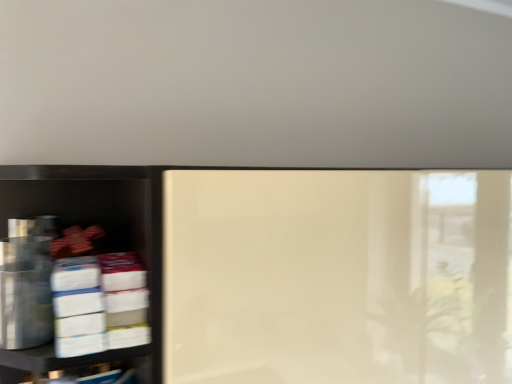
Question: From a real-world perspective, relative to metallic silver canisters at left, marked as the second shelf in a right-to-left arrangement, is matte white shelf at center, which is the first shelf in right-to-left order, vertically above or below?

Choices:
 (A) above
 (B) below

Answer: (B)

Question: Is matte white shelf at center, the second shelf positioned from the left, wider or thinner than metallic silver canisters at left, marked as the second shelf in a right-to-left arrangement?

Choices:
 (A) wide
 (B) thin

Answer: (A)

Question: Is matte white shelf at center, which is the first shelf in right-to-left order, inside the boundaries of metallic silver canisters at left, which is counted as the 1th shelf, starting from the left, or outside?

Choices:
 (A) inside
 (B) outside

Answer: (B)

Question: Considering the relative positions of metallic silver canisters at left, marked as the second shelf in a right-to-left arrangement, and matte white shelf at center, which is the first shelf in right-to-left order, in the image provided, is metallic silver canisters at left, marked as the second shelf in a right-to-left arrangement, to the left or to the right of matte white shelf at center, which is the first shelf in right-to-left order,?

Choices:
 (A) right
 (B) left

Answer: (B)

Question: Relative to matte white shelf at center, which is the first shelf in right-to-left order, is metallic silver canisters at left, marked as the second shelf in a right-to-left arrangement, in front or behind?

Choices:
 (A) front
 (B) behind

Answer: (A)

Question: Does point (131, 223) appear closer or farther from the camera than point (398, 228)?

Choices:
 (A) closer
 (B) farther

Answer: (B)

Question: From the image's perspective, relative to matte white shelf at center, which is the first shelf in right-to-left order, is metallic silver canisters at left, marked as the second shelf in a right-to-left arrangement, above or below?

Choices:
 (A) above
 (B) below

Answer: (A)